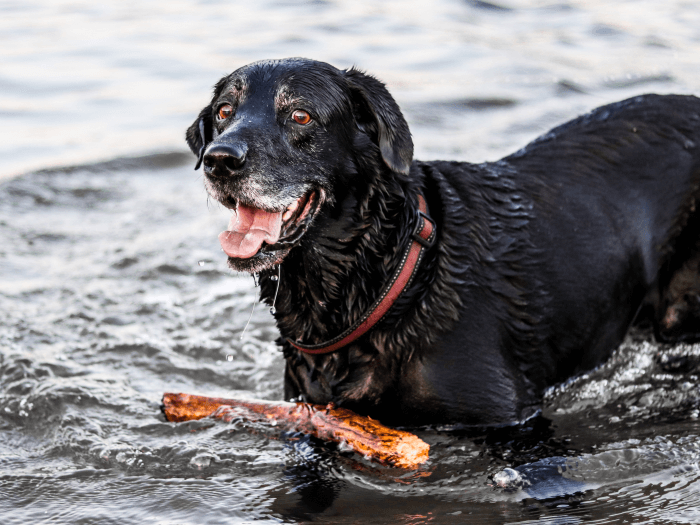
You are a GUI agent. You are given a task and a screenshot of the screen. Output one action in this format:
    pyautogui.click(x=<x>, y=<y>)
    Task: Click on the white fur
    The height and width of the screenshot is (525, 700).
    Given the screenshot: What is the action you would take?
    pyautogui.click(x=265, y=195), pyautogui.click(x=214, y=186), pyautogui.click(x=237, y=90), pyautogui.click(x=280, y=90), pyautogui.click(x=363, y=387)